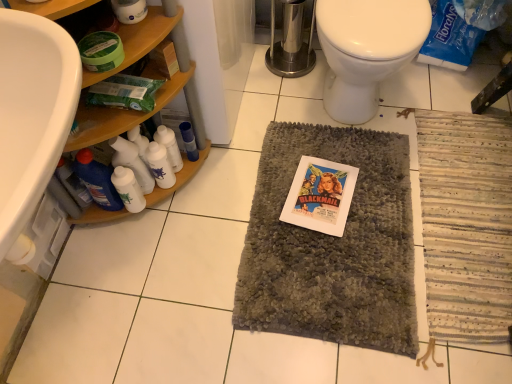
At what (x,y) coordinates should I click in order to perform the action: click on vacant space to the right of white plastic bottles at left, placed as the fourth bottle when sorted from left to right. Please return your answer as a coordinate pair (x, y). Looking at the image, I should click on tap(224, 171).